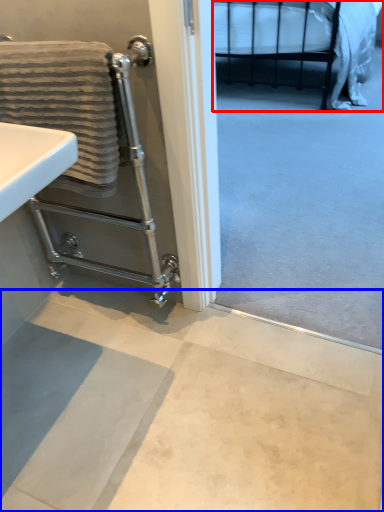
Question: Which of the following is the closest to the observer, bed (highlighted by a red box) or concrete (highlighted by a blue box)?

Choices:
 (A) bed
 (B) concrete

Answer: (B)